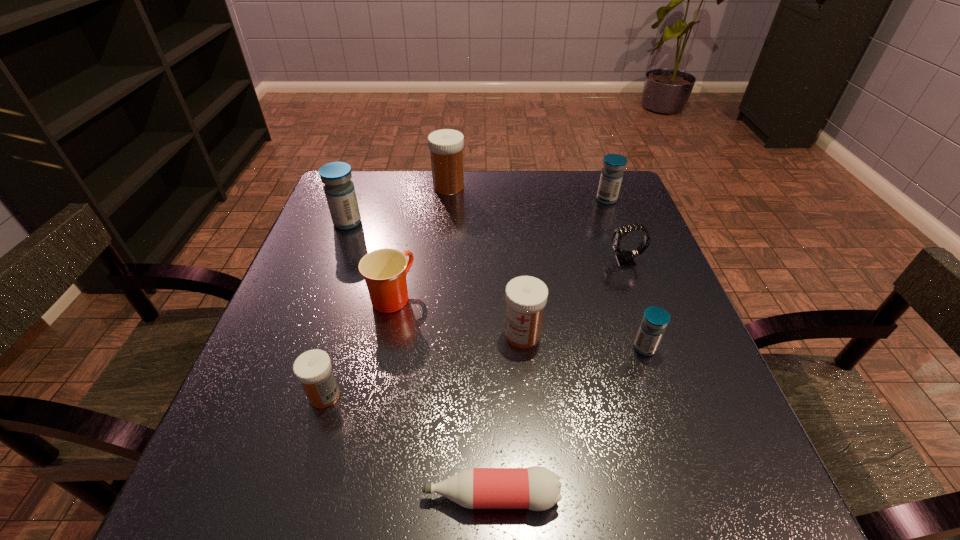
Where is `watch`? watch is located at coordinates (625, 258).

Locate an element on the screen. the smallest blue medicine is located at coordinates (655, 320).

The height and width of the screenshot is (540, 960). In order to click on the fifth medicine from right to left in this screenshot , I will do `click(313, 368)`.

The height and width of the screenshot is (540, 960). Identify the location of the smallest white medicine. (313, 368).

Locate an element on the screen. This screenshot has width=960, height=540. the nearest object is located at coordinates (537, 488).

I want to click on bottle, so click(537, 488).

Image resolution: width=960 pixels, height=540 pixels. What are the coordinates of `vacant region located on the front of the farthest white medicine` in the screenshot? It's located at (445, 219).

What are the coordinates of `vacant region located on the right of the third farthest object` in the screenshot? It's located at (425, 222).

Image resolution: width=960 pixels, height=540 pixels. Identify the location of vacant space located 0.250m on the left of the farthest blue medicine. (503, 199).

This screenshot has width=960, height=540. I want to click on vacant region located on the front of the second smallest white medicine, so click(539, 510).